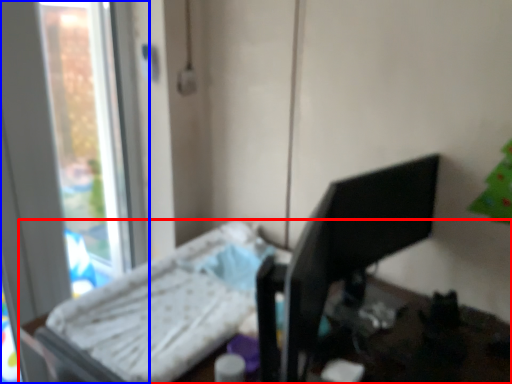
Question: Which object appears farthest to the camera in this image, furniture (highlighted by a red box) or window (highlighted by a blue box)?

Choices:
 (A) furniture
 (B) window

Answer: (B)